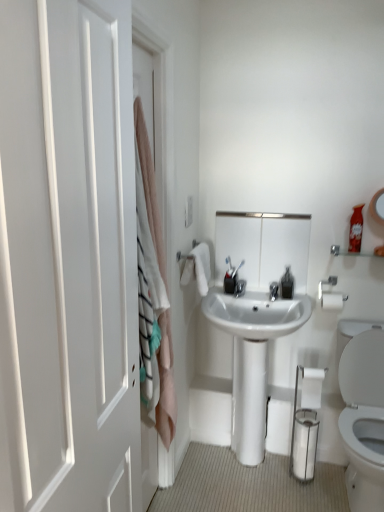
This screenshot has width=384, height=512. What are the coordinates of `free space above white glossy medicine cabinet at center (from a real-world perspective)` in the screenshot? It's located at (261, 212).